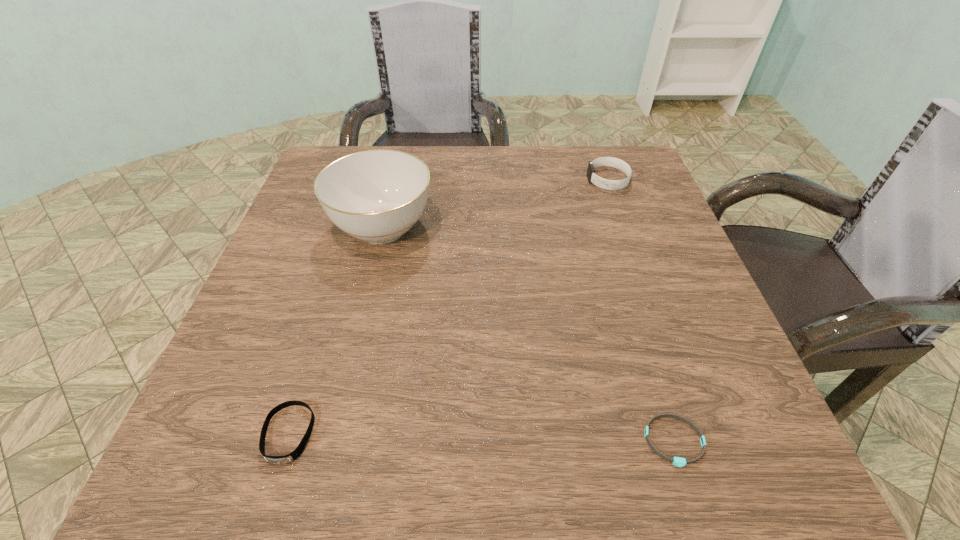
You are a GUI agent. You are given a task and a screenshot of the screen. Output one action in this format:
    pyautogui.click(x=<x>, y=<y>)
    Task: Click on the vacant region that satisfies the following two spatial constraints: 1. on the outer surface of the third shortest object; 2. on the buckle of the shortest object
    
    Given the screenshot: What is the action you would take?
    pyautogui.click(x=702, y=441)

Identify the location of vacant region that satisfies the following two spatial constraints: 1. on the outer surface of the farthest wristband; 2. on the display of the second shortest object. (699, 434).

Locate an element on the screen. vacant area that satisfies the following two spatial constraints: 1. on the outer surface of the farthest wristband; 2. on the display of the second shortest wristband is located at coordinates (699, 434).

I want to click on free space that satisfies the following two spatial constraints: 1. on the outer surface of the farthest wristband; 2. on the buckle of the shortest wristband, so click(702, 441).